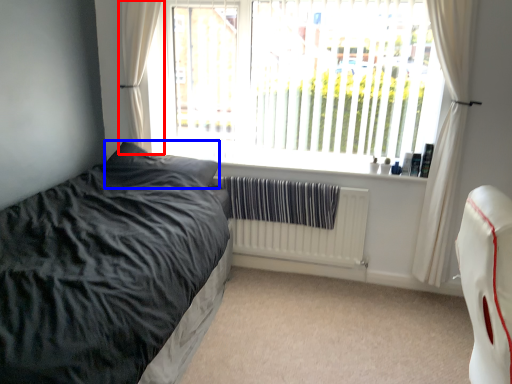
Question: Which of the following is the closest to the observer, curtain (highlighted by a red box) or pillow (highlighted by a blue box)?

Choices:
 (A) curtain
 (B) pillow

Answer: (B)